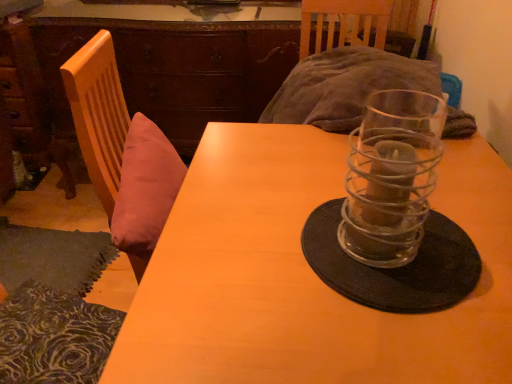
Question: Could black matte glass plate at center be considered to be inside wooden table at center?

Choices:
 (A) yes
 (B) no

Answer: (A)

Question: From the image's perspective, does wooden table at center appear higher than black matte glass plate at center?

Choices:
 (A) no
 (B) yes

Answer: (A)

Question: Does wooden table at center have a greater width compared to black matte glass plate at center?

Choices:
 (A) yes
 (B) no

Answer: (A)

Question: From a real-world perspective, is wooden table at center positioned under black matte glass plate at center based on gravity?

Choices:
 (A) no
 (B) yes

Answer: (B)

Question: Can you confirm if wooden table at center is taller than black matte glass plate at center?

Choices:
 (A) no
 (B) yes

Answer: (B)

Question: Are wooden table at center and black matte glass plate at center beside each other?

Choices:
 (A) no
 (B) yes

Answer: (A)

Question: Does black matte glass plate at center have a greater height compared to wooden table at center?

Choices:
 (A) yes
 (B) no

Answer: (B)

Question: Is black matte glass plate at center not within wooden table at center?

Choices:
 (A) yes
 (B) no

Answer: (B)

Question: Is black matte glass plate at center shorter than wooden table at center?

Choices:
 (A) yes
 (B) no

Answer: (A)

Question: From a real-world perspective, does black matte glass plate at center stand above wooden table at center?

Choices:
 (A) yes
 (B) no

Answer: (A)

Question: Is black matte glass plate at center positioned in front of wooden table at center?

Choices:
 (A) yes
 (B) no

Answer: (B)

Question: From a real-world perspective, is black matte glass plate at center located beneath wooden table at center?

Choices:
 (A) no
 (B) yes

Answer: (A)

Question: Is clear glass candle holder at center a part of black matte glass plate at center?

Choices:
 (A) yes
 (B) no

Answer: (B)